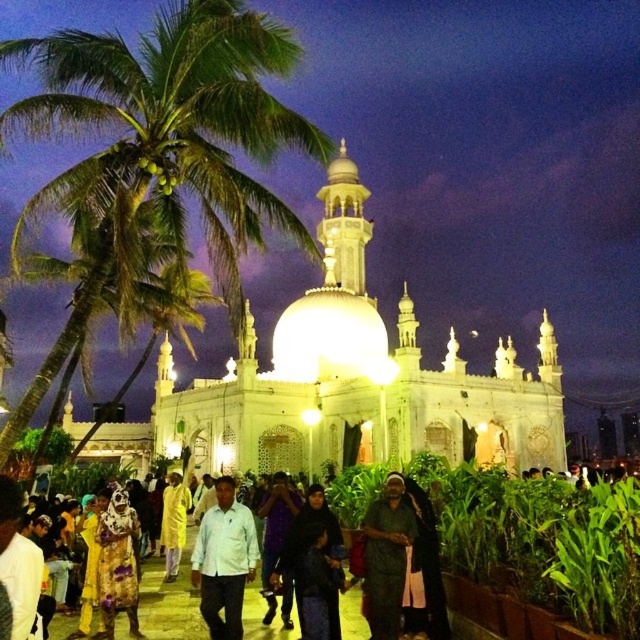
Question: Which point is farther from the camera taking this photo?

Choices:
 (A) (180, 518)
 (B) (72, 212)
 (C) (212, 609)
 (D) (388, 506)

Answer: (B)

Question: Can you confirm if green leafy palm tree at left is positioned below dark green fabric at lower left?

Choices:
 (A) yes
 (B) no

Answer: (B)

Question: Among these objects, which one is nearest to the camera?

Choices:
 (A) white matte shirt at center
 (B) light yellow fabric at center
 (C) dark green fabric at center

Answer: (C)

Question: Can you confirm if dark green fabric at lower left is positioned to the left of white matte shirt at center?

Choices:
 (A) no
 (B) yes

Answer: (A)

Question: Is dark green fabric at lower left positioned at the back of white matte shirt at center?

Choices:
 (A) no
 (B) yes

Answer: (B)

Question: Which of these objects is positioned closest to the green leafy palm tree at left?

Choices:
 (A) white matte shirt at center
 (B) dark green fabric at center
 (C) dark green fabric at lower left

Answer: (A)